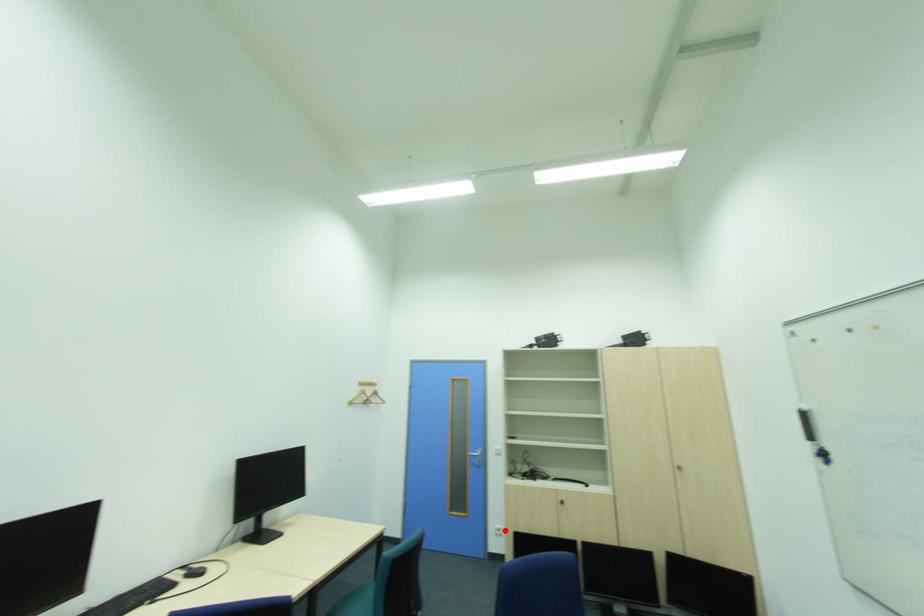
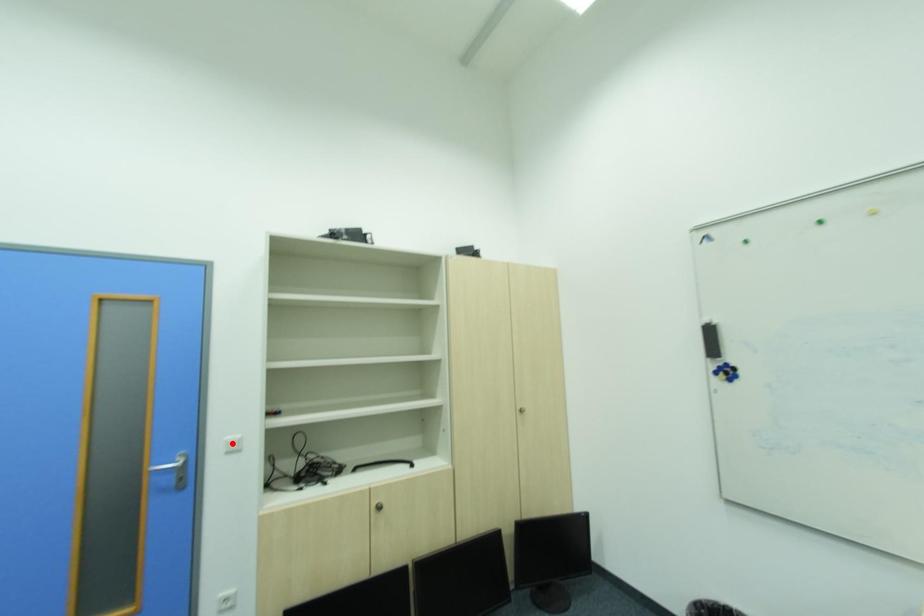
From the picture: I am providing you with two images of the same scene from different viewpoints. A red point is marked on the first image and another point is marked on the second image. Is the red point in image1 aligned with the point shown in image2?

No